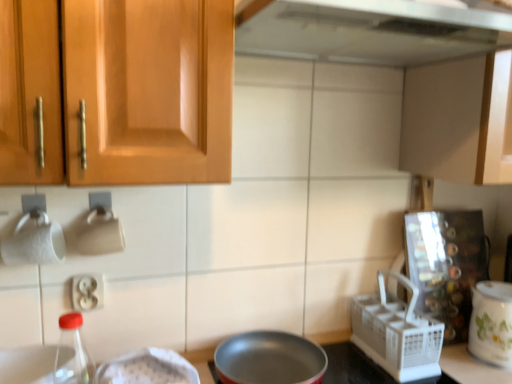
Question: Looking at their shapes, would you say transparent glass bottle at lower left is wider or thinner than white plastic electrical outlet at lower left?

Choices:
 (A) wide
 (B) thin

Answer: (A)

Question: From the image's perspective, is transparent glass bottle at lower left positioned above or below white plastic electrical outlet at lower left?

Choices:
 (A) below
 (B) above

Answer: (A)

Question: Estimate the real-world distances between objects in this image. Which object is closer to the white plastic electrical outlet at lower left?

Choices:
 (A) white ceramic pot at right
 (B) white plastic basket at right
 (C) transparent glass bottle at lower left
 (D) matte wood cabinet at upper right

Answer: (C)

Question: Which of these objects is positioned closest to the transparent glass bottle at lower left?

Choices:
 (A) white plastic electrical outlet at lower left
 (B) white ceramic pot at right
 (C) white plastic basket at right
 (D) matte wood cabinet at upper right

Answer: (A)